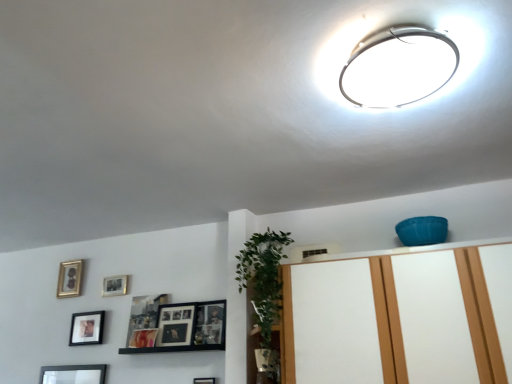
Question: Which direction should I rotate to look at black matte picture frame at lower center, positioned as the fifth picture frame in left-to-right order?

Choices:
 (A) right
 (B) left

Answer: (B)

Question: Is matte black picture frame at upper left, marked as the third picture frame in a left-to-right arrangement, shorter than green leafy plant at center?

Choices:
 (A) yes
 (B) no

Answer: (A)

Question: Does matte black picture frame at upper left, the 2th picture frame in the back-to-front sequence, lie in front of green leafy plant at center?

Choices:
 (A) yes
 (B) no

Answer: (B)

Question: From a real-world perspective, is matte black picture frame at upper left, the 2th picture frame in the back-to-front sequence, under green leafy plant at center?

Choices:
 (A) no
 (B) yes

Answer: (A)

Question: From the image's perspective, is matte black picture frame at upper left, which appears as the 4th picture frame when viewed from the front, located beneath green leafy plant at center?

Choices:
 (A) no
 (B) yes

Answer: (B)

Question: Is green leafy plant at center completely or partially inside matte black picture frame at upper left, the 3th picture frame from the right?

Choices:
 (A) yes
 (B) no

Answer: (B)

Question: From the image's perspective, does matte black picture frame at upper left, which appears as the 4th picture frame when viewed from the front, appear higher than green leafy plant at center?

Choices:
 (A) yes
 (B) no

Answer: (B)

Question: Is black matte picture frame at lower center, positioned as the fifth picture frame in left-to-right order, behind green leafy plant at center?

Choices:
 (A) no
 (B) yes

Answer: (B)

Question: Considering the relative sizes of black matte picture frame at lower center, positioned as the 5th picture frame in back-to-front order, and green leafy plant at center in the image provided, is black matte picture frame at lower center, positioned as the 5th picture frame in back-to-front order, taller than green leafy plant at center?

Choices:
 (A) yes
 (B) no

Answer: (B)

Question: Can you confirm if black matte picture frame at lower center, which is the 1th picture frame from front to back, is positioned to the right of green leafy plant at center?

Choices:
 (A) no
 (B) yes

Answer: (A)

Question: Is black matte picture frame at lower center, which is the 1th picture frame from front to back, outside green leafy plant at center?

Choices:
 (A) yes
 (B) no

Answer: (A)

Question: Does black matte picture frame at lower center, which is the 1th picture frame from front to back, turn towards green leafy plant at center?

Choices:
 (A) no
 (B) yes

Answer: (A)

Question: Is black matte picture frame at lower center, positioned as the 5th picture frame in back-to-front order, shorter than green leafy plant at center?

Choices:
 (A) yes
 (B) no

Answer: (A)

Question: Can you confirm if black matte picture frame at lower center, which is the 1th picture frame from front to back, is taller than white glossy dresser at upper center?

Choices:
 (A) no
 (B) yes

Answer: (A)